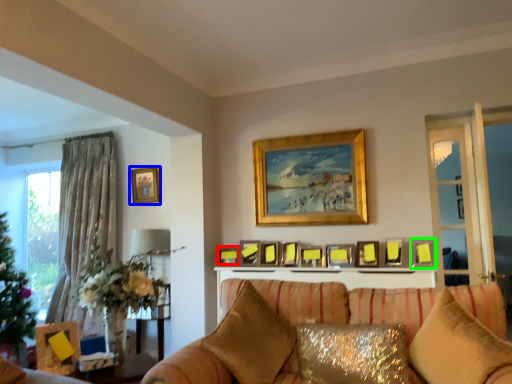
Question: Based on their relative distances, which object is farther from picture frame (highlighted by a red box)? Choose from picture frame (highlighted by a blue box) and picture frame (highlighted by a green box).

Choices:
 (A) picture frame
 (B) picture frame

Answer: (B)